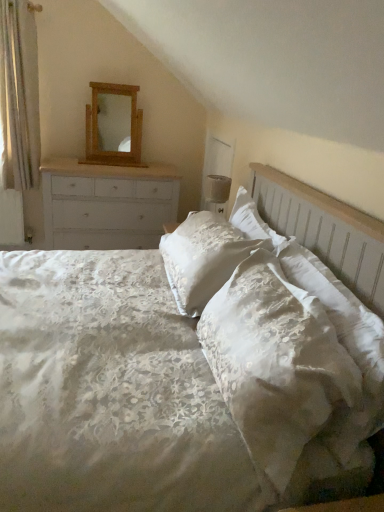
Question: From the image's perspective, is linen bed at center over matte white lampshade at upper right?

Choices:
 (A) yes
 (B) no

Answer: (B)

Question: Considering the relative positions of linen bed at center and matte white lampshade at upper right in the image provided, is linen bed at center to the left of matte white lampshade at upper right from the viewer's perspective?

Choices:
 (A) yes
 (B) no

Answer: (A)

Question: From a real-world perspective, is linen bed at center positioned under matte white lampshade at upper right based on gravity?

Choices:
 (A) no
 (B) yes

Answer: (B)

Question: Is linen bed at center thinner than matte white lampshade at upper right?

Choices:
 (A) no
 (B) yes

Answer: (A)

Question: Is linen bed at center placed right next to matte white lampshade at upper right?

Choices:
 (A) no
 (B) yes

Answer: (A)

Question: Does linen bed at center have a greater height compared to matte white lampshade at upper right?

Choices:
 (A) yes
 (B) no

Answer: (A)

Question: Can we say matte white lampshade at upper right lies outside white satin pillow at center?

Choices:
 (A) no
 (B) yes

Answer: (B)

Question: Is matte white lampshade at upper right smaller than white satin pillow at center?

Choices:
 (A) no
 (B) yes

Answer: (B)

Question: From a real-world perspective, does matte white lampshade at upper right stand above white satin pillow at center?

Choices:
 (A) no
 (B) yes

Answer: (B)

Question: Does matte white lampshade at upper right have a lesser height compared to white satin pillow at center?

Choices:
 (A) no
 (B) yes

Answer: (B)

Question: Does matte white lampshade at upper right have a greater height compared to white satin pillow at center?

Choices:
 (A) yes
 (B) no

Answer: (B)

Question: From a real-world perspective, is matte white lampshade at upper right below white satin pillow at center?

Choices:
 (A) no
 (B) yes

Answer: (A)

Question: From the image's perspective, is wooden mirror at upper center above white painted wood chest of drawers at left?

Choices:
 (A) yes
 (B) no

Answer: (A)